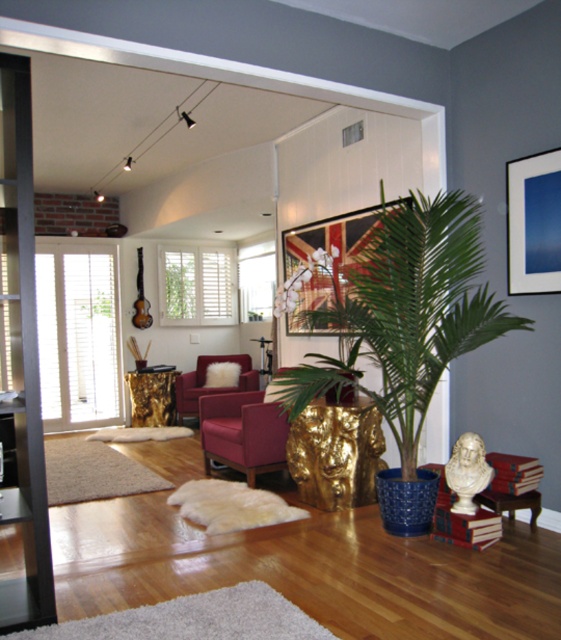
Question: Which point appears farthest from the camera in this image?

Choices:
 (A) (526, 324)
 (B) (247, 388)

Answer: (B)

Question: Does blue matte picture frame at upper right have a larger size compared to velvet burgundy armchair at center?

Choices:
 (A) no
 (B) yes

Answer: (A)

Question: Can you confirm if metallic gold picture frame at upper center is positioned below velvet burgundy armchair at center?

Choices:
 (A) yes
 (B) no

Answer: (B)

Question: Which point appears closest to the camera in this image?

Choices:
 (A) click(227, 388)
 (B) click(462, 224)

Answer: (B)

Question: Is green glossy plant at center closer to camera compared to velvet burgundy armchair at center?

Choices:
 (A) yes
 (B) no

Answer: (A)

Question: Which object is closer to the camera taking this photo?

Choices:
 (A) blue matte picture frame at upper right
 (B) green glossy plant at center

Answer: (B)